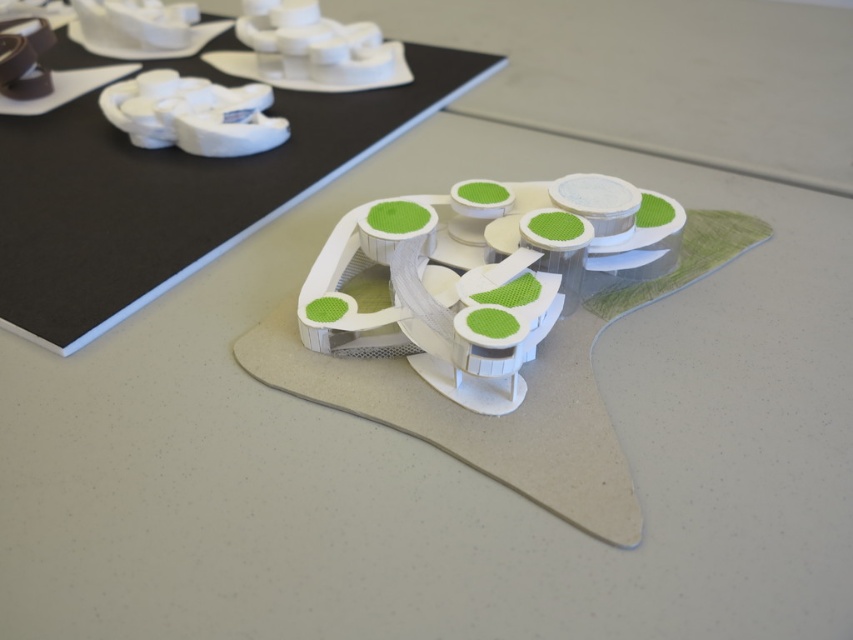
What is located at the point with coordinates (483, 275) in the image?

The point with coordinates (483, 275) indicates the location of the white textured toy at center.

You are an architect examining the 3D printed models. You need to determine which toy is taller between the white textured toy at center and the white matte toy at upper left. Which one is taller?

The white textured toy at center has a greater height compared to the white matte toy at upper left, so the white textured toy at center is taller.